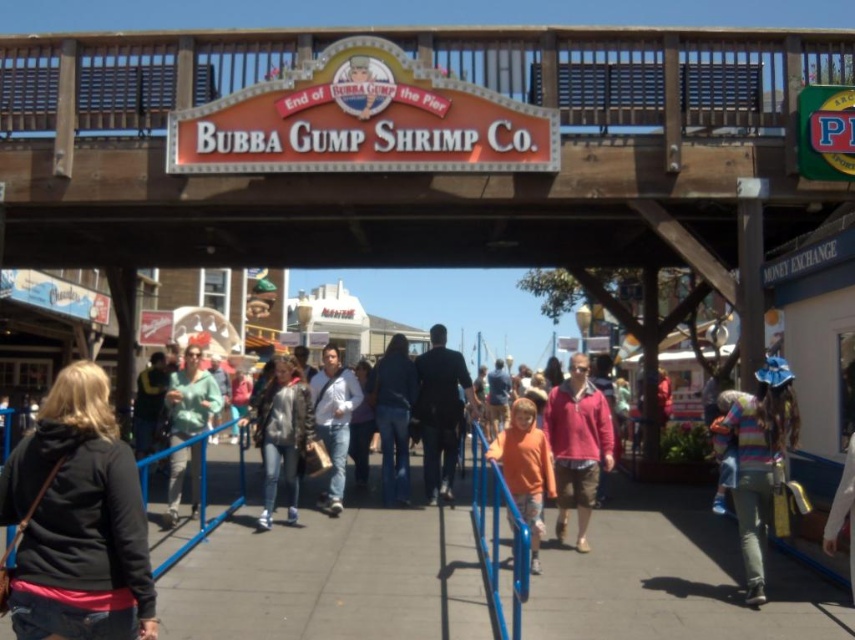
You are standing at the entrance of the pier and want to take a photo of the two points mentioned. Which point, point (276, 464) or point (388, 422), is closer to you?

Point (276, 464) is closer to the viewer than point (388, 422).